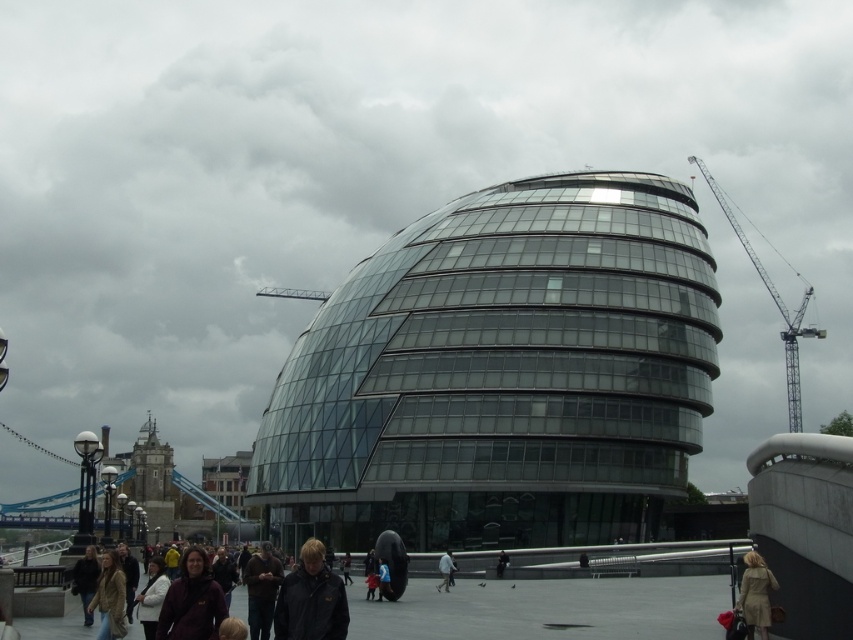
Question: Can you confirm if maroon fleece jacket at lower left is positioned to the left of metallic gray crane at upper right?

Choices:
 (A) yes
 (B) no

Answer: (A)

Question: Can you confirm if leather jacket at lower left is positioned to the left of dark brown leather jacket at center?

Choices:
 (A) yes
 (B) no

Answer: (A)

Question: Which object appears closest to the camera in this image?

Choices:
 (A) tan leather coat at lower right
 (B) dark gray matte jacket at lower center

Answer: (B)

Question: Which of the following is the closest to the observer?

Choices:
 (A) (447, 582)
 (B) (643, 227)
 (C) (315, 564)

Answer: (C)

Question: Can you confirm if leather jacket at lower left is bigger than light brown leather jacket at center?

Choices:
 (A) no
 (B) yes

Answer: (B)

Question: Which of these objects is positioned farthest from the light brown leather jacket at center?

Choices:
 (A) metallic gray crane at upper right
 (B) dark gray jacket at center
 (C) maroon fleece jacket at lower left

Answer: (A)